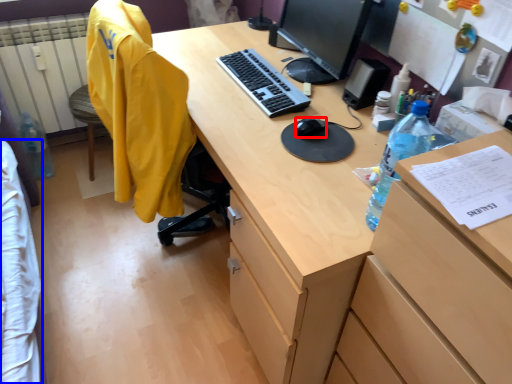
Question: Which object appears farthest to the camera in this image, mouse (highlighted by a red box) or clothing (highlighted by a blue box)?

Choices:
 (A) mouse
 (B) clothing

Answer: (A)